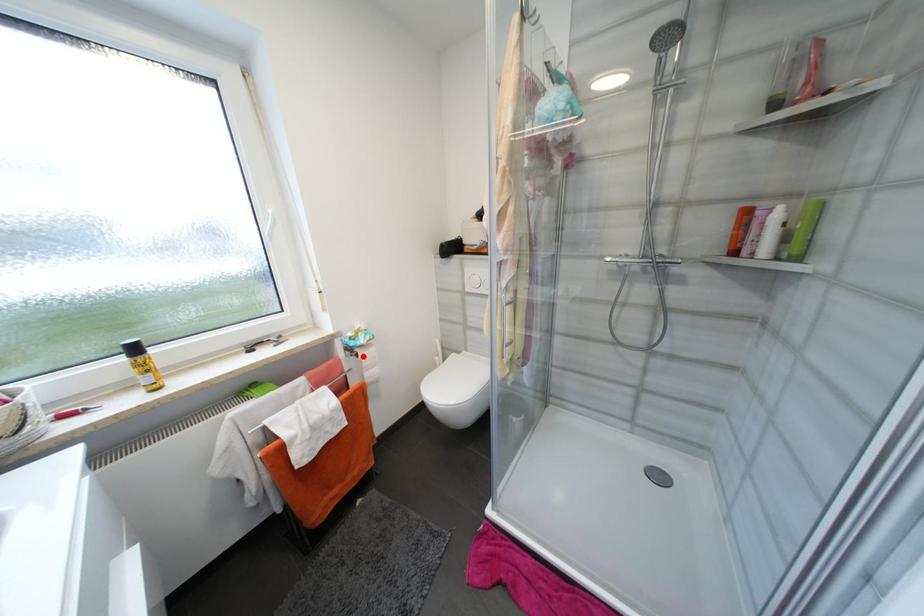
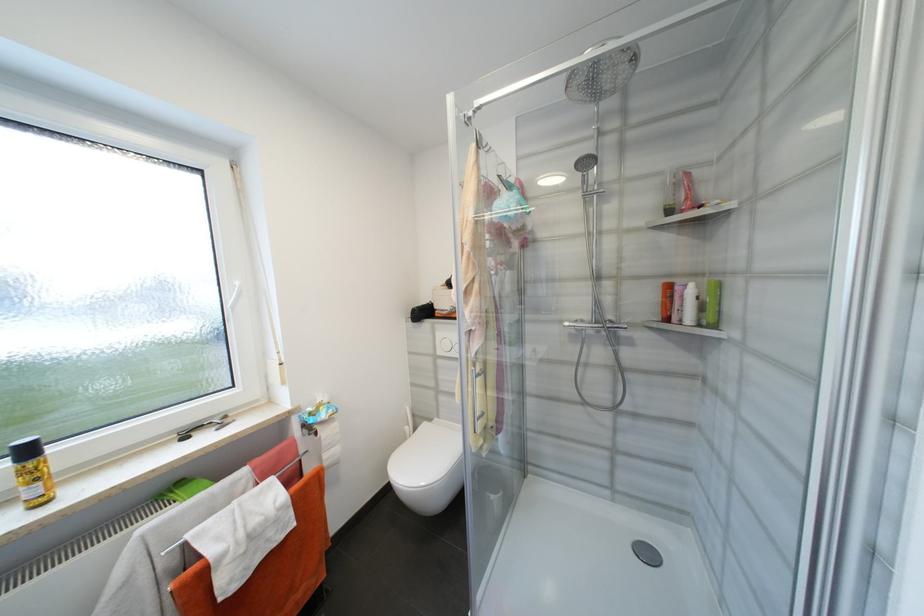
Locate, in the second image, the point that corresponds to the highlighted location in the first image.

(322, 435)